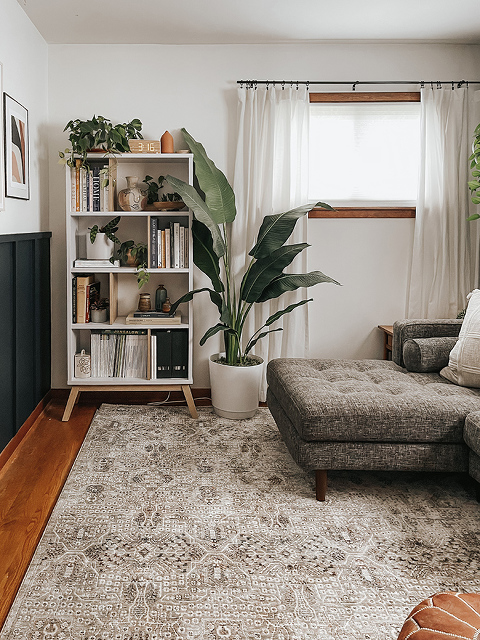
Locate an element on the screen. window is located at coordinates (365, 141).